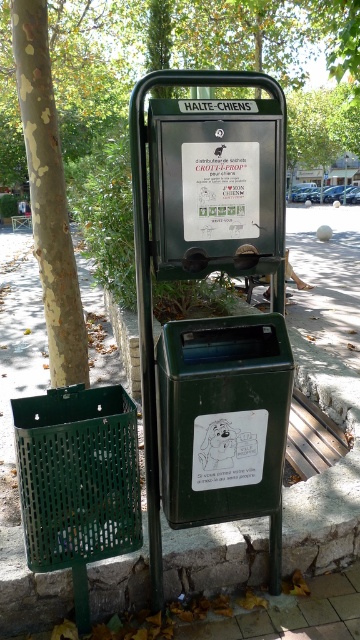
You are a dog owner who just took your pet for a walk. You see the green matte bin at center and the white paper sign at center. Which object should you interact with first to properly dispose of your dog waste according to the station design?

The white paper sign at center provides instructions for using the bag dispenser, so you should first read the instructions on the white paper sign at center before using the green matte bin at center to dispose of the waste.

You are a pedestrian standing in front of the dog waste station. You want to place a new trash bin between the green plastic bus stop at center and the green leafy tree at upper center. Which object should the trash bin be closer to?

The trash bin should be placed closer to the green plastic bus stop at center because it is closer to the viewer than the green leafy tree at upper center.